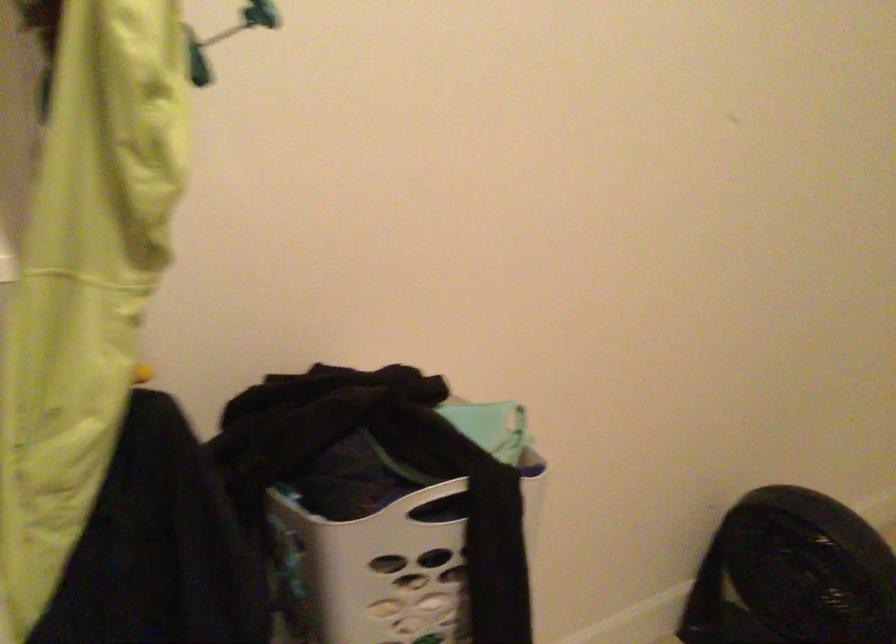
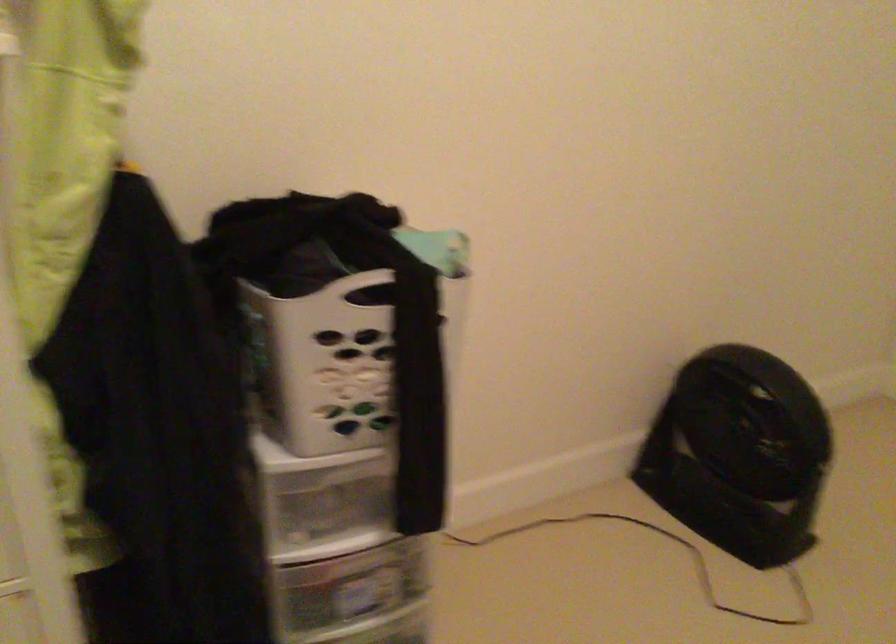
Question: How did the camera likely rotate?

Choices:
 (A) Left
 (B) Right
 (C) Up
 (D) Down

Answer: (D)